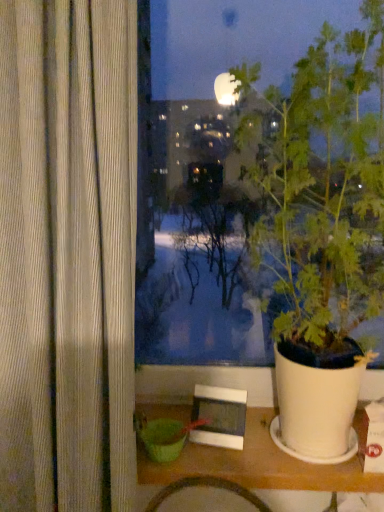
What do you see at coordinates (323, 231) in the screenshot? This screenshot has height=512, width=384. I see `green matte plant at right` at bounding box center [323, 231].

What is the approximate height of green matte plant at right?

The height of green matte plant at right is 37.50 inches.

The width and height of the screenshot is (384, 512). I want to click on green matte plant at right, so click(323, 231).

Locate an element on the screen. The height and width of the screenshot is (512, 384). green matte plant at right is located at coordinates (323, 231).